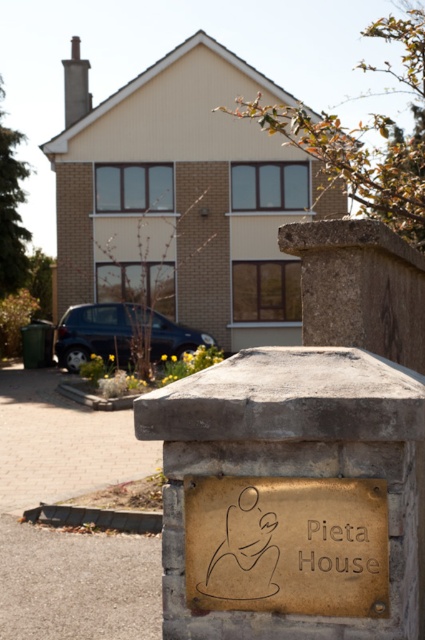
Looking at this image, you are standing at the point marked as point (x=374, y=548) and want to take a photo of the house. If your camera is 1.6 meters tall, will the green trash bin block your view of the house?

The distance between point (x=374, y=548) and the camera is 2.55 meters. Since the camera is 1.6 meters tall, the green trash bin might block the view if it is positioned between you and the house at that distance. However, without knowing the exact height and position of the green trash bin relative to the line of sight, it is impossible to determine for sure.

You are standing at the front of the house and want to walk towards the green trash bin. Which point, point (x=269, y=509) or point (x=365, y=541), is closer to your path?

Point (x=365, y=541) is closer to your path because it is in front of point (x=269, y=509), which is behind it.

You are a delivery person trying to read the address on the gold textured plaque at center and the gold embossed sign at center. Which one is wider?

The gold textured plaque at center might be wider than gold embossed sign at center.